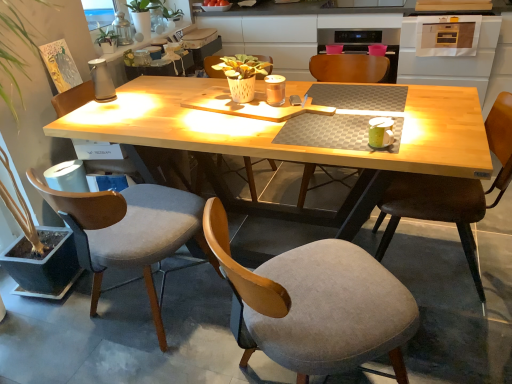
At what (x,y) coordinates should I click in order to perform the action: click on vacant space that is to the left of green matte coffee cup at upper right. Please return your answer as a coordinate pair (x, y). Image resolution: width=512 pixels, height=384 pixels. Looking at the image, I should click on (327, 142).